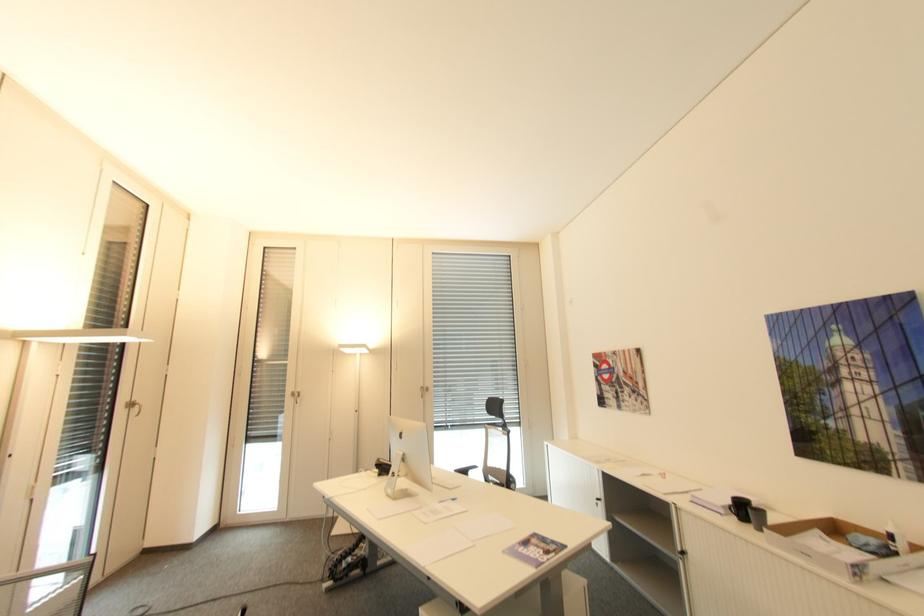
Find where to open the purple booklet. Please return your answer as a coordinate pair (x, y).

(535, 549)